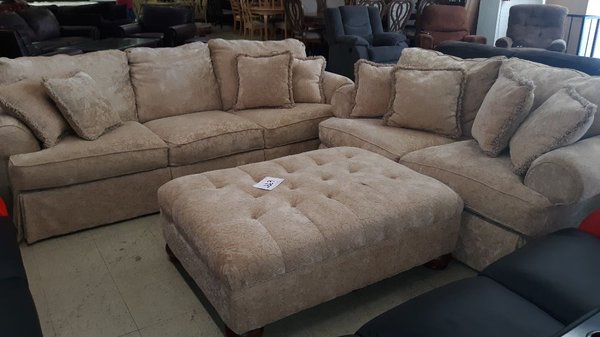
Locate an element on the screen. The image size is (600, 337). navy blue chair is located at coordinates (363, 36).